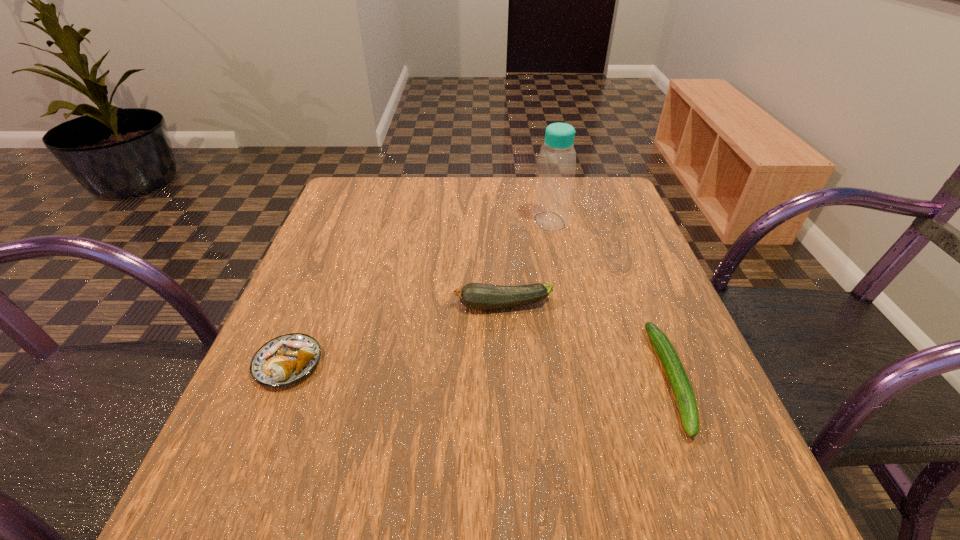
The width and height of the screenshot is (960, 540). In order to click on vacant region between the farthest object and the leftmost object in this screenshot , I will do `click(419, 293)`.

Locate an element on the screen. The image size is (960, 540). vacant area between the bottle and the nearer zucchini is located at coordinates (611, 300).

Where is `free space between the tallest object and the shorter zucchini`? Image resolution: width=960 pixels, height=540 pixels. free space between the tallest object and the shorter zucchini is located at coordinates (611, 300).

I want to click on free space between the shortest object and the third tallest object, so (x=480, y=372).

Find the location of a particular element. The image size is (960, 540). object that is the second closest to the third tallest object is located at coordinates (556, 166).

Find the location of a particular element. The height and width of the screenshot is (540, 960). object that stands as the third closest to the left zucchini is located at coordinates (287, 359).

Identify the location of free spot that satisfies the following two spatial constraints: 1. at the blossom end of the taller zucchini; 2. on the front side of the leftmost object. (506, 363).